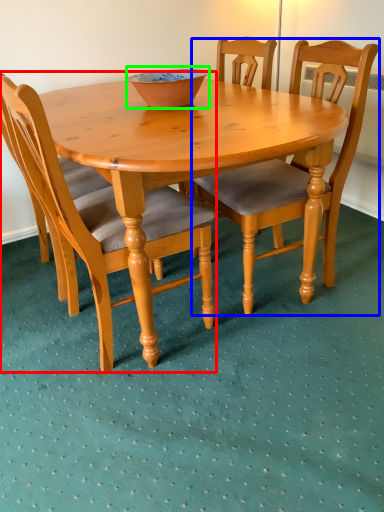
Question: Considering the real-world distances, which object is farthest from chair (highlighted by a red box)? chair (highlighted by a blue box) or bowl (highlighted by a green box)?

Choices:
 (A) chair
 (B) bowl

Answer: (B)